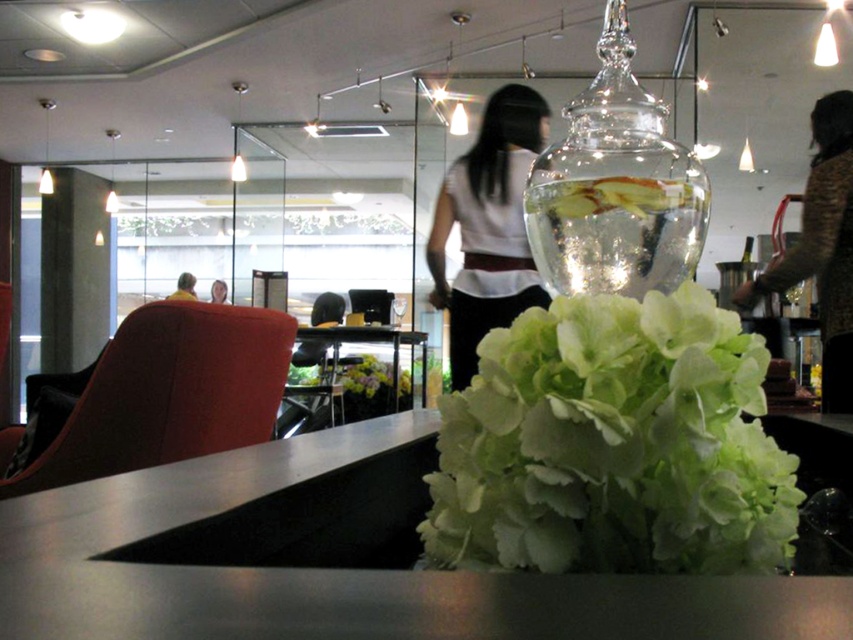
Question: Does green leafy flowers at center come in front of white matte shirt at center?

Choices:
 (A) yes
 (B) no

Answer: (A)

Question: Which point is farther to the camera?

Choices:
 (A) white matte shirt at center
 (B) smooth yellow shirt at center
 (C) brown textured sweater at upper right
 (D) green leafy flowers at center

Answer: (B)

Question: Which object is positioned farthest from the brown textured sweater at upper right?

Choices:
 (A) transparent glass fishbowl at upper center
 (B) yellow shirt at left

Answer: (B)

Question: Among these objects, which one is nearest to the camera?

Choices:
 (A) white matte shirt at center
 (B) brown textured sweater at upper right

Answer: (B)

Question: Does brown textured sweater at upper right have a larger size compared to yellow shirt at left?

Choices:
 (A) yes
 (B) no

Answer: (A)

Question: Can you confirm if green leafy flowers at center is smaller than transparent glass fishbowl at upper center?

Choices:
 (A) yes
 (B) no

Answer: (A)